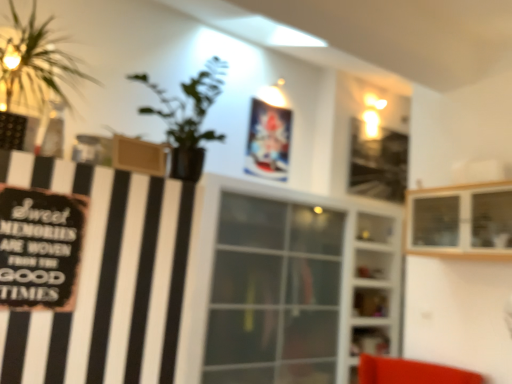
Question: Considering the relative sizes of green leafy plant at left and wooden cabinet at upper right, the 1th shelf viewed from the front, in the image provided, is green leafy plant at left smaller than wooden cabinet at upper right, the 1th shelf viewed from the front,?

Choices:
 (A) no
 (B) yes

Answer: (B)

Question: Is green leafy plant at left closer to camera compared to wooden cabinet at upper right, the 1th shelf viewed from the front?

Choices:
 (A) yes
 (B) no

Answer: (A)

Question: Is green leafy plant at left taller than wooden cabinet at upper right, the 1th shelf viewed from the front?

Choices:
 (A) yes
 (B) no

Answer: (A)

Question: Is green leafy plant at left to the left of wooden cabinet at upper right, the second shelf viewed from the back, from the viewer's perspective?

Choices:
 (A) yes
 (B) no

Answer: (A)

Question: Is green leafy plant at left bigger than wooden cabinet at upper right, the 1th shelf viewed from the front?

Choices:
 (A) yes
 (B) no

Answer: (B)

Question: Would you say black matte signboard at left is inside or outside wooden cabinet at upper right, placed as the first shelf when sorted from top to bottom?

Choices:
 (A) outside
 (B) inside

Answer: (A)

Question: From the image's perspective, relative to wooden cabinet at upper right, placed as the first shelf when sorted from top to bottom, is black matte signboard at left above or below?

Choices:
 (A) above
 (B) below

Answer: (A)

Question: From a real-world perspective, is black matte signboard at left above or below wooden cabinet at upper right, the second shelf ordered from the bottom?

Choices:
 (A) above
 (B) below

Answer: (B)

Question: Considering the positions of point click(x=5, y=223) and point click(x=453, y=226), is point click(x=5, y=223) closer or farther from the camera than point click(x=453, y=226)?

Choices:
 (A) farther
 (B) closer

Answer: (B)

Question: Looking at their shapes, would you say black matte signboard at left is wider or thinner than transparent glass shelves at center, the 1th shelf when ordered from back to front?

Choices:
 (A) thin
 (B) wide

Answer: (A)

Question: Relative to transparent glass shelves at center, the 1th shelf when ordered from back to front, is black matte signboard at left in front or behind?

Choices:
 (A) behind
 (B) front

Answer: (B)

Question: Is point (27, 261) positioned closer to the camera than point (370, 302)?

Choices:
 (A) closer
 (B) farther

Answer: (A)

Question: From a real-world perspective, is black matte signboard at left physically located above or below transparent glass shelves at center, the 1th shelf when ordered from back to front?

Choices:
 (A) above
 (B) below

Answer: (A)

Question: Is transparent glass window at center wider or thinner than green leafy plant at left?

Choices:
 (A) wide
 (B) thin

Answer: (A)

Question: From a real-world perspective, is transparent glass window at center above or below green leafy plant at left?

Choices:
 (A) below
 (B) above

Answer: (A)